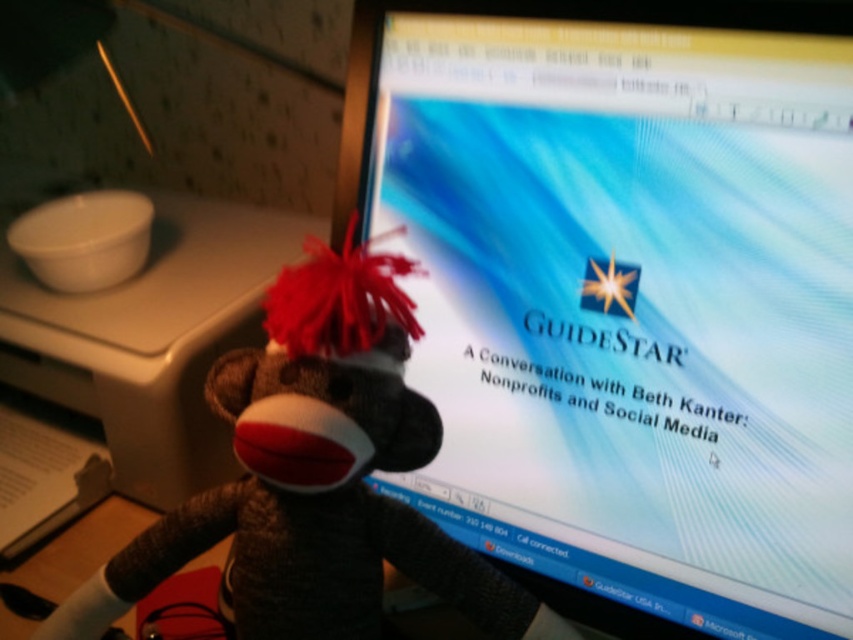
Question: Which object is positioned farthest from the brown fuzzy sock monkey at center?

Choices:
 (A) matte plastic monitor at center
 (B) matte white plastic at left

Answer: (B)

Question: Among these points, which one is nearest to the camera?

Choices:
 (A) (439, 522)
 (B) (230, 412)
 (C) (250, 248)

Answer: (B)

Question: Observing the image, what is the correct spatial positioning of matte plastic monitor at center in reference to matte white plastic at left?

Choices:
 (A) right
 (B) left

Answer: (A)

Question: Estimate the real-world distances between objects in this image. Which object is closer to the matte plastic monitor at center?

Choices:
 (A) brown fuzzy sock monkey at center
 (B) matte white plastic at left

Answer: (A)

Question: Is brown fuzzy sock monkey at center above matte white plastic at left?

Choices:
 (A) no
 (B) yes

Answer: (A)

Question: Can you confirm if matte plastic monitor at center is positioned above matte white plastic at left?

Choices:
 (A) no
 (B) yes

Answer: (A)